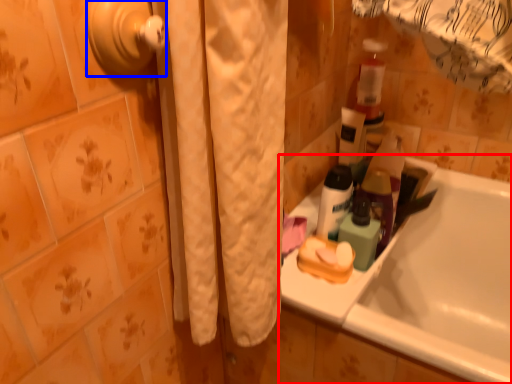
Question: Which of the following is the farthest to the observer, bathtub (highlighted by a red box) or door handle (highlighted by a blue box)?

Choices:
 (A) bathtub
 (B) door handle

Answer: (A)